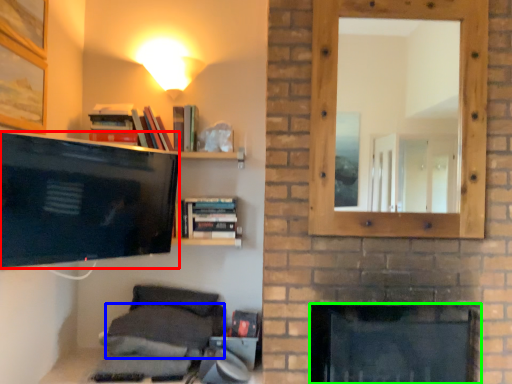
Question: Based on their relative distances, which object is farther from television (highlighted by a red box)? Choose from pillow (highlighted by a blue box) and fireplace (highlighted by a green box).

Choices:
 (A) pillow
 (B) fireplace

Answer: (B)